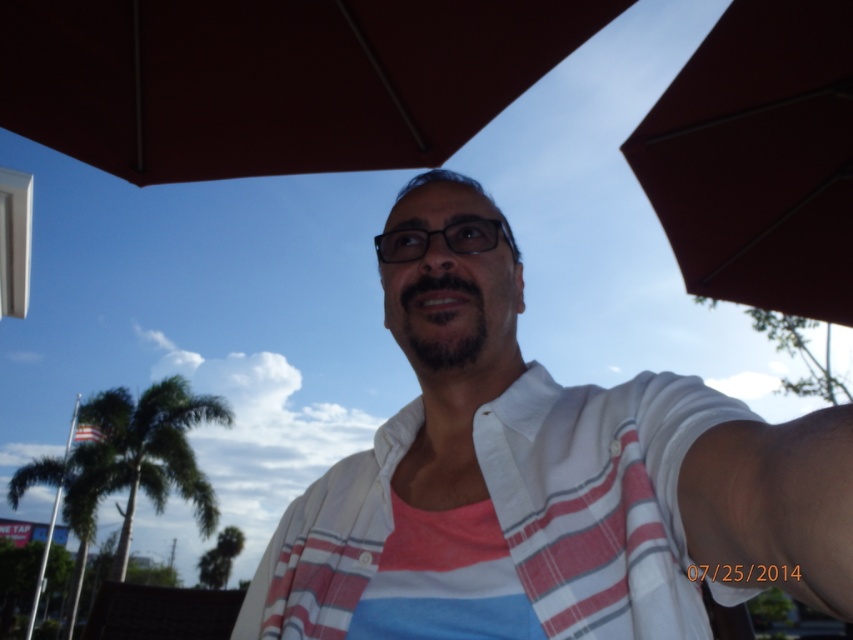
You are a photographer analyzing the composition of this image. The point marked at coordinates (759, 157) corresponds to an object in the scene. Which object is it?

The point at coordinates (759, 157) corresponds to the matte red umbrella at upper right.

You are planning to take a photo under the brown matte umbrella at upper center and want to ensure the green leafy palm tree at lower left is visible in the background. Based on their positions, will the palm tree be fully visible in the photo?

The brown matte umbrella at upper center is above the green leafy palm tree at lower left, so the palm tree will be fully visible in the background as the umbrella is positioned higher up and not blocking it.